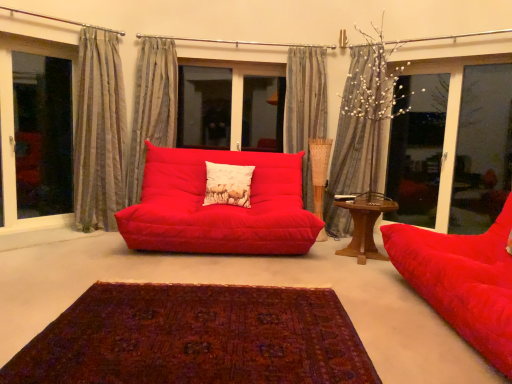
This screenshot has height=384, width=512. In order to click on free space that is in between wooden table at right and deep burgundy woven rug at center in this screenshot , I will do [x=323, y=280].